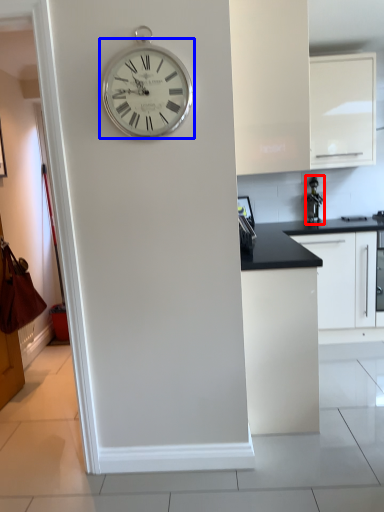
Question: Which point is closer to the camera, appliance (highlighted by a red box) or wall clock (highlighted by a blue box)?

Choices:
 (A) appliance
 (B) wall clock

Answer: (B)